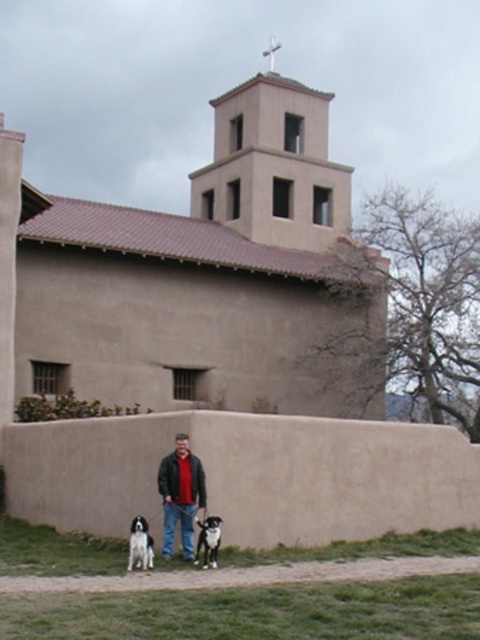
Is point (181, 508) positioned in front of point (203, 534)?

No, (181, 508) is further to viewer.

Which is more to the left, dark gray jacket at center or black and white fur at lower center?

From the viewer's perspective, dark gray jacket at center appears more on the left side.

Does point (169, 522) come farther from viewer compared to point (217, 548)?

Yes.

Find the location of `dark gray jacket at center`. dark gray jacket at center is located at coordinates (180, 493).

What do you see at coordinates (140, 545) in the screenshot?
I see `white fur dog at lower left` at bounding box center [140, 545].

Which is more to the right, white fur dog at lower left or black and white fur at lower center?

Result: Positioned to the right is black and white fur at lower center.

Which is in front, point (148, 532) or point (216, 531)?

Point (216, 531) is in front.

Where is `white fur dog at lower left`? white fur dog at lower left is located at coordinates pyautogui.click(x=140, y=545).

Who is positioned more to the left, dark gray jacket at center or white fur dog at lower left?

white fur dog at lower left

Between dark gray jacket at center and white fur dog at lower left, which one appears on the right side from the viewer's perspective?

Positioned to the right is dark gray jacket at center.

Describe the element at coordinates (180, 493) in the screenshot. Image resolution: width=480 pixels, height=640 pixels. I see `dark gray jacket at center` at that location.

Where is `dark gray jacket at center`? This screenshot has height=640, width=480. dark gray jacket at center is located at coordinates (180, 493).